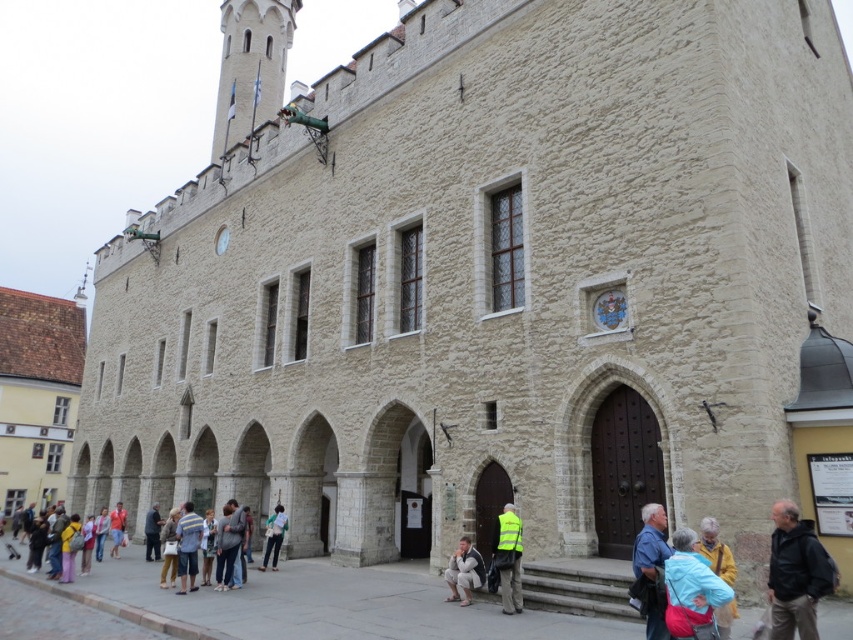
Question: Which point is farther from the camera taking this photo?

Choices:
 (A) (277, 96)
 (B) (55, 442)
 (C) (685, 637)

Answer: (A)

Question: Which object appears farthest from the camera in this image?

Choices:
 (A) orange shirt at lower left
 (B) dark gray fabric pants at lower left

Answer: (A)

Question: Considering the relative positions of black fabric jacket at lower right and striped shirt at lower center in the image provided, where is black fabric jacket at lower right located with respect to striped shirt at lower center?

Choices:
 (A) below
 (B) above

Answer: (B)

Question: Can you confirm if brown stone church at left is thinner than striped shirt at lower center?

Choices:
 (A) no
 (B) yes

Answer: (A)

Question: Which point is closer to the camera?

Choices:
 (A) yellow reflective vest at center
 (B) light blue fabric jacket at lower right
 (C) white stone tower at upper left

Answer: (B)

Question: In this image, where is white stone tower at upper left located relative to white fabric statue at lower center?

Choices:
 (A) above
 (B) below

Answer: (A)